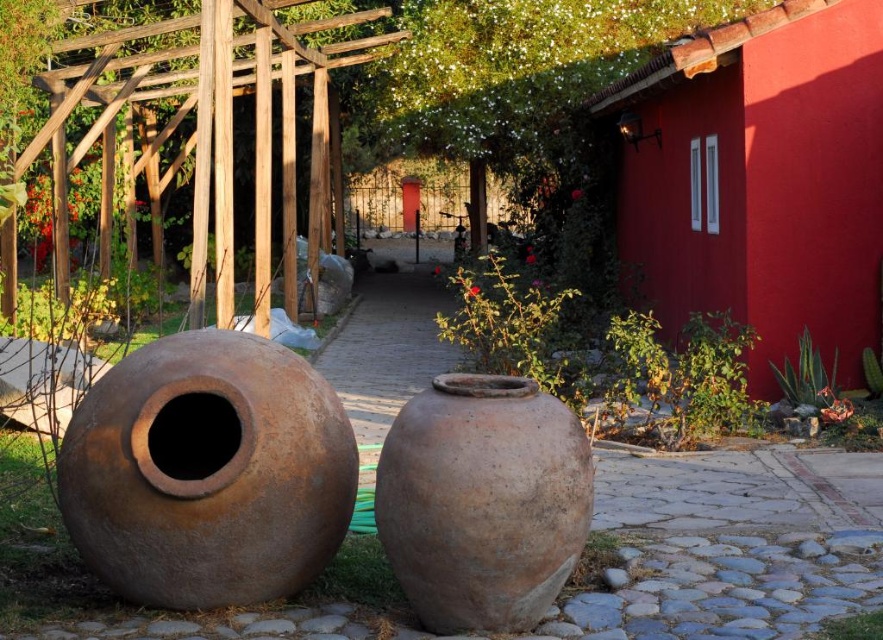
Question: Can you confirm if rusty clay pot at left is positioned above brown clay vase at center?

Choices:
 (A) no
 (B) yes

Answer: (B)

Question: Is the position of rusty clay pot at left less distant than that of brown clay vase at center?

Choices:
 (A) yes
 (B) no

Answer: (B)

Question: Observing the image, what is the correct spatial positioning of rusty clay pot at left in reference to brown clay vase at center?

Choices:
 (A) right
 (B) left

Answer: (B)